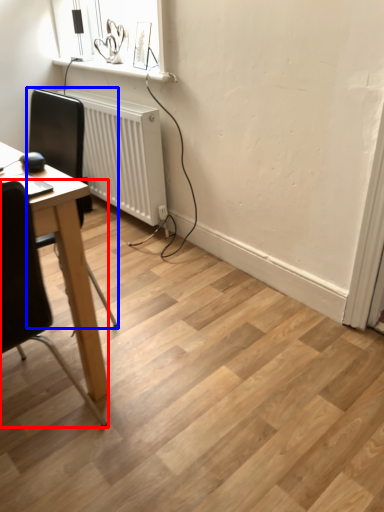
Question: Which object is closer to the camera taking this photo, chair (highlighted by a red box) or chair (highlighted by a blue box)?

Choices:
 (A) chair
 (B) chair

Answer: (A)